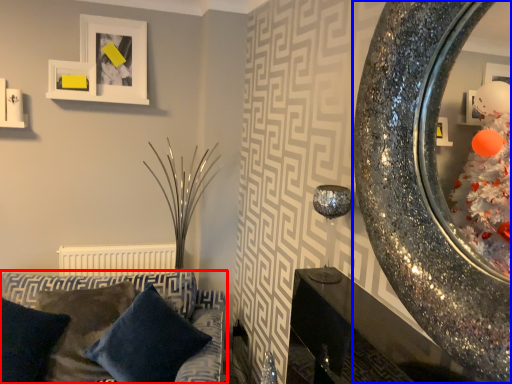
Question: Which object appears closest to the camera in this image, studio couch (highlighted by a red box) or mirror (highlighted by a blue box)?

Choices:
 (A) studio couch
 (B) mirror

Answer: (B)